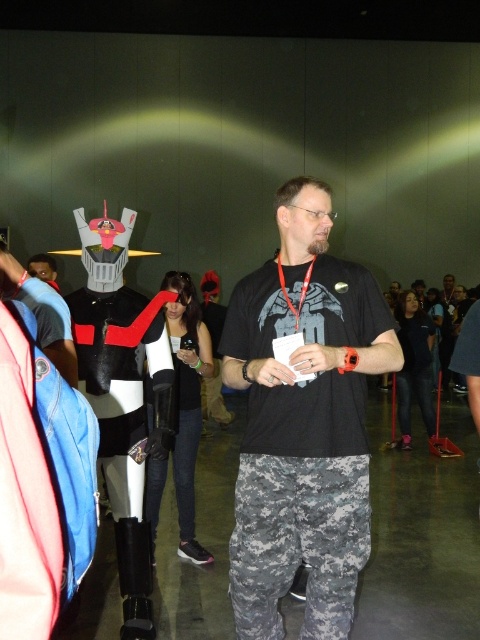
Is digital camo pants at center positioned in front of matte black neck at center?

Yes.

Between point (287, 588) and point (283, 257), which one is positioned behind?

Positioned behind is point (283, 257).

Locate an element on the screen. This screenshot has width=480, height=640. digital camo pants at center is located at coordinates (298, 541).

Looking at this image, does black matte t-shirt at center have a lesser height compared to matte black neck at center?

No, black matte t-shirt at center is not shorter than matte black neck at center.

Is black matte t-shirt at center in front of matte black neck at center?

That is True.

Describe the element at coordinates (303, 429) in the screenshot. I see `black matte t-shirt at center` at that location.

Find the location of a particular element. The height and width of the screenshot is (640, 480). black matte t-shirt at center is located at coordinates (303, 429).

Between black matte t-shirt at center and red fabric lanyard at center, which one has more height?

With more height is black matte t-shirt at center.

Does black matte t-shirt at center have a greater height compared to red fabric lanyard at center?

Indeed, black matte t-shirt at center has a greater height compared to red fabric lanyard at center.

What do you see at coordinates (303, 429) in the screenshot?
I see `black matte t-shirt at center` at bounding box center [303, 429].

The width and height of the screenshot is (480, 640). Identify the location of black matte t-shirt at center. (303, 429).